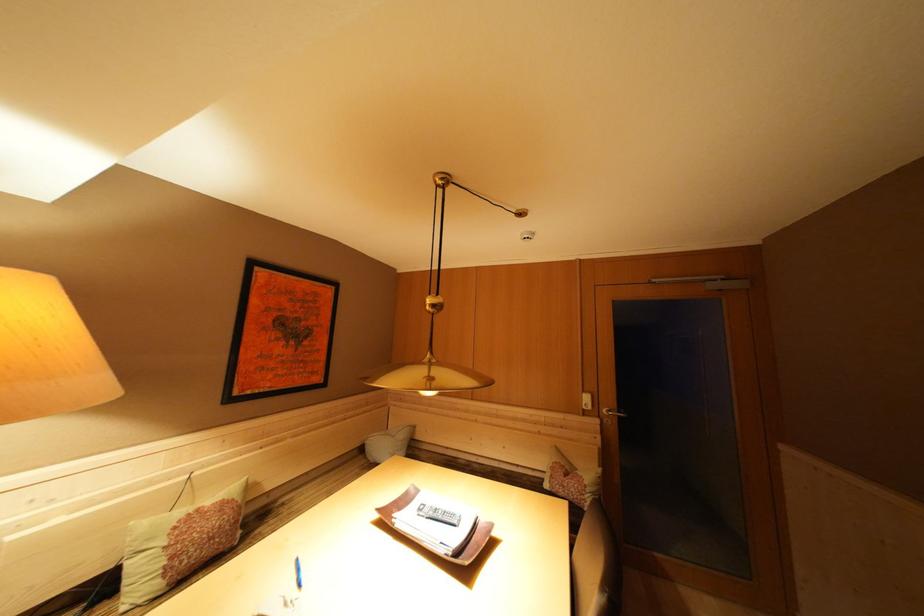
At what (x,y) coordinates should I click in order to perform the action: click on white light switch. Please return your answer as a coordinate pair (x, y). The image size is (924, 616). Looking at the image, I should click on (586, 400).